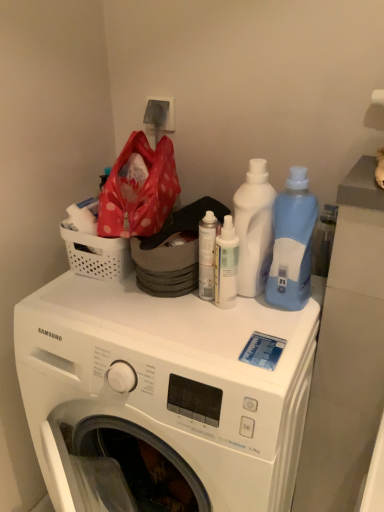
Locate an element on the screen. The width and height of the screenshot is (384, 512). free spot above white plastic washing machine at center (from a real-world perspective) is located at coordinates coord(146,313).